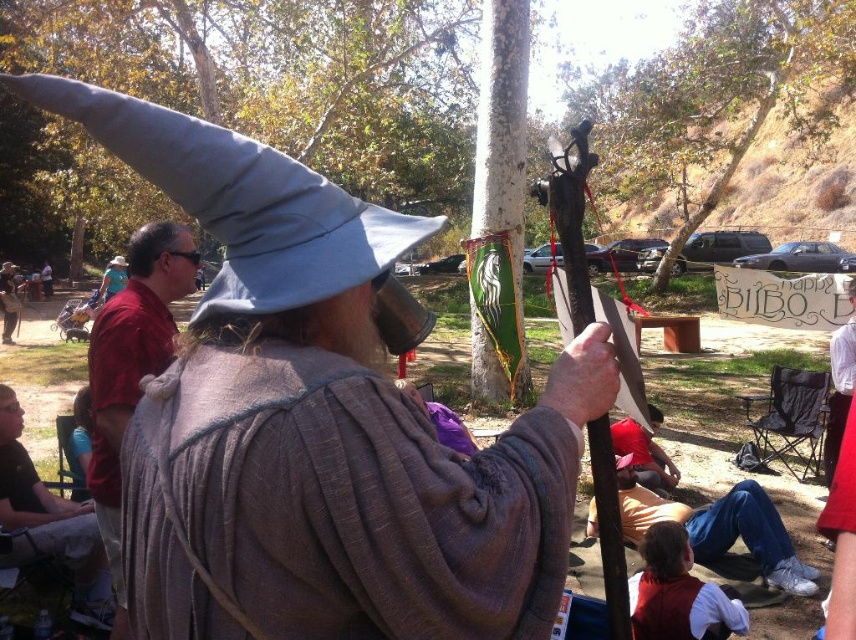
Does matte red shirt at left have a smaller size compared to brown leather jacket at lower left?

No.

Can you confirm if matte red shirt at left is taller than brown leather jacket at lower left?

Indeed, matte red shirt at left has a greater height compared to brown leather jacket at lower left.

What do you see at coordinates (131, 368) in the screenshot? This screenshot has width=856, height=640. I see `matte red shirt at left` at bounding box center [131, 368].

Find the location of a particular element. matte red shirt at left is located at coordinates (131, 368).